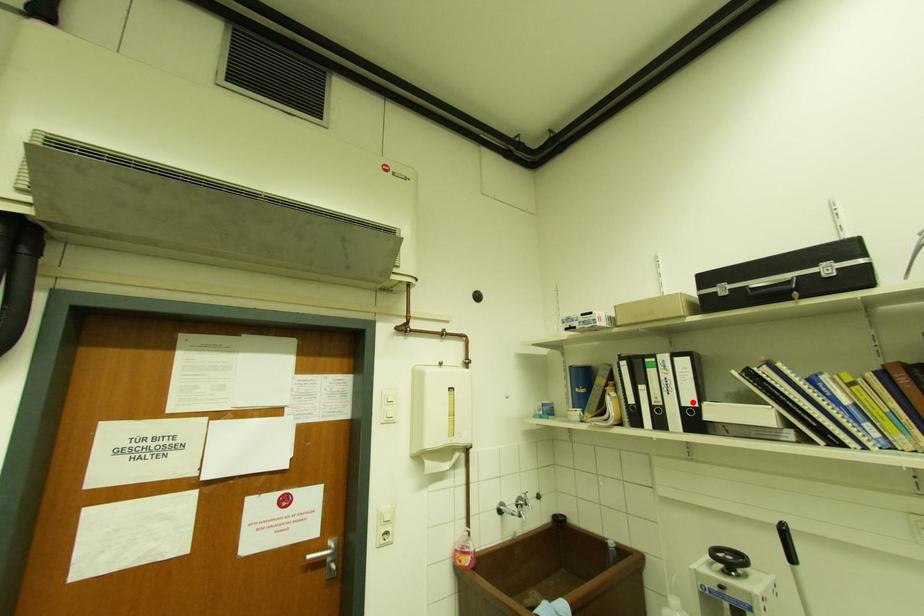
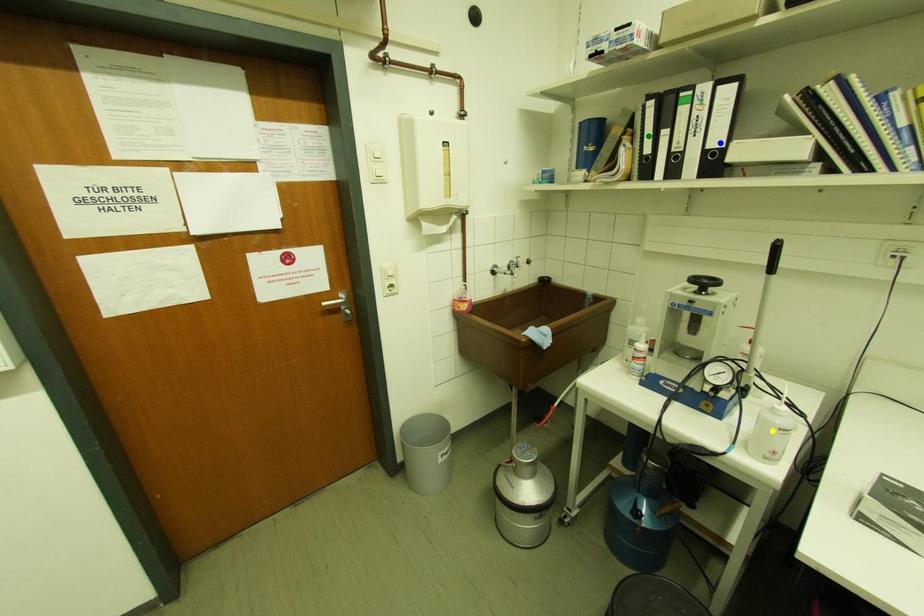
Question: I am providing you with two images of the same scene from different viewpoints. A red point is marked on the first image. You are given multiple points on the second image. Which point in image 2 is actually the same real-world point as the red point in image 1?

Choices:
 (A) blue point
 (B) green point
 (C) yellow point

Answer: (A)